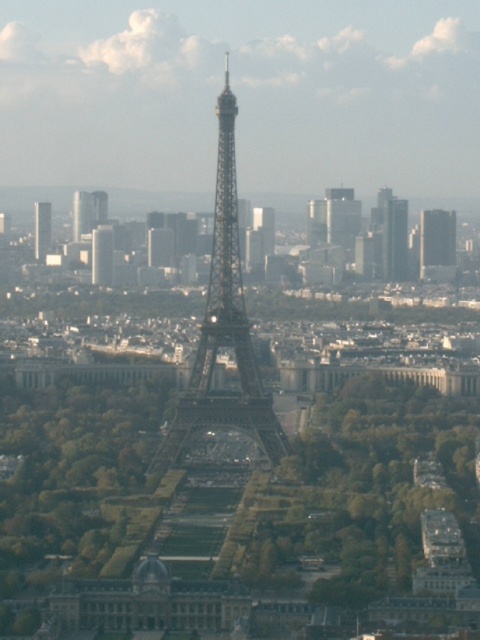
You are a tourist standing in the park near the Eiffel Tower. You see the green leafy trees at center and the smooth glass skyscraper at right. Which object is bigger in size?

The green leafy trees at center has a larger size compared to the smooth glass skyscraper at right.

You are a tourist standing in the park near the Eiffel Tower. You see the green leafy trees at center and the smooth glass skyscraper at right. Which object is located to the left of the other?

The green leafy trees at center is positioned on the left side of smooth glass skyscraper at right.